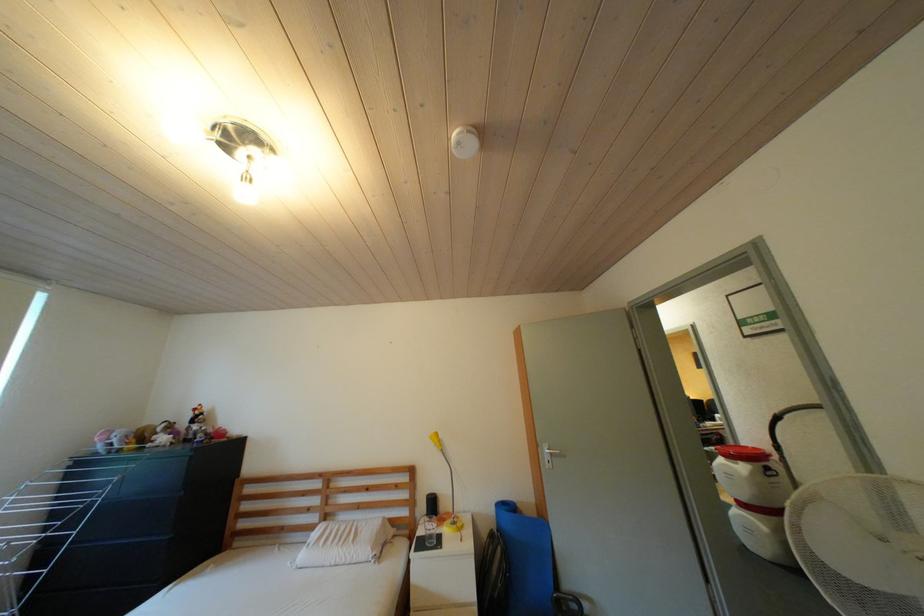
The width and height of the screenshot is (924, 616). What do you see at coordinates (743, 453) in the screenshot?
I see `the red container lid` at bounding box center [743, 453].